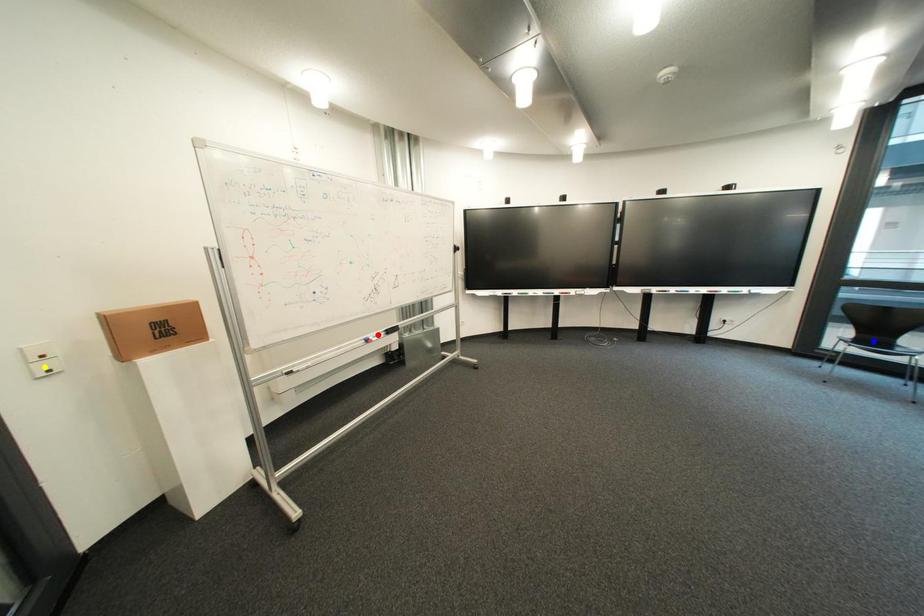
Order these from nearest to farthest:
blue point
yellow point
red point

blue point → red point → yellow point